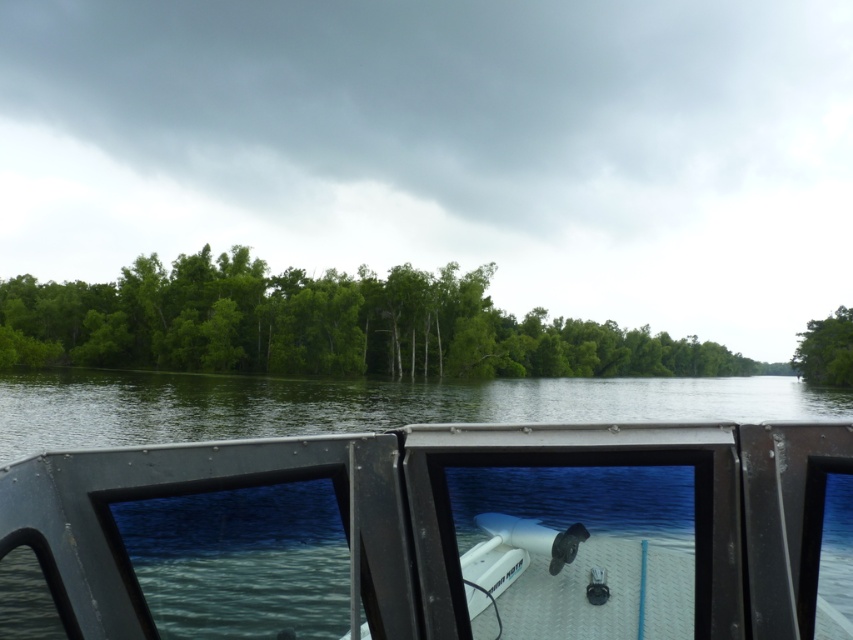
Does green leafy trees at center appear over green leafy tree at right?

Yes.

Which is above, green leafy trees at center or green leafy tree at right?

green leafy trees at center is higher up.

The height and width of the screenshot is (640, 853). What do you see at coordinates (326, 324) in the screenshot? I see `green leafy trees at center` at bounding box center [326, 324].

The image size is (853, 640). Identify the location of green leafy trees at center. (326, 324).

Does point (383, 509) lie behind point (181, 364)?

No, it is not.

Can you confirm if white matte boat at center is taller than green leafy trees at center?

No.

Which is behind, point (840, 625) or point (26, 298)?

The point (26, 298) is more distant.

Locate an element on the screen. The height and width of the screenshot is (640, 853). white matte boat at center is located at coordinates (434, 534).

Which is behind, point (752, 570) or point (845, 358)?

The point (845, 358) is more distant.

Looking at this image, who is higher up, white matte boat at center or green leafy tree at right?

white matte boat at center

Identify the location of white matte boat at center. The image size is (853, 640). (434, 534).